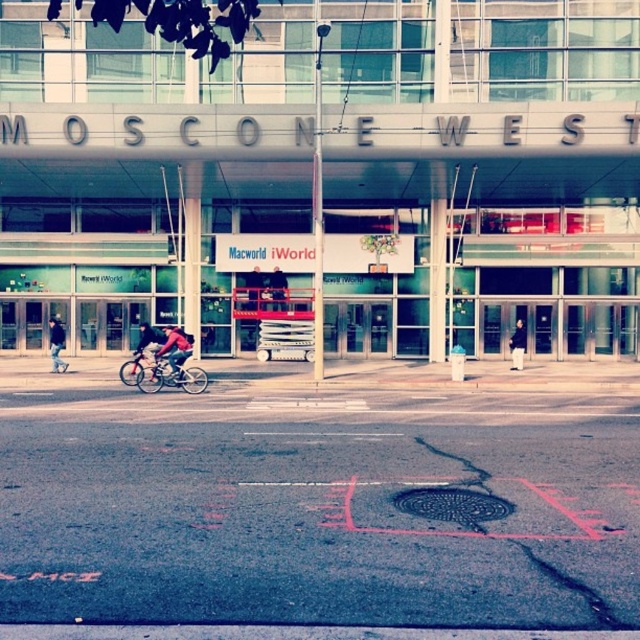
Consider the image. You are standing in front of Moscone West and notice two people on the sidewalk. One is wearing a red jacket at center and the other has dark blue jeans at left. Which person appears bigger in the image?

The red jacket at center appears larger in the image compared to the dark blue jeans at left.